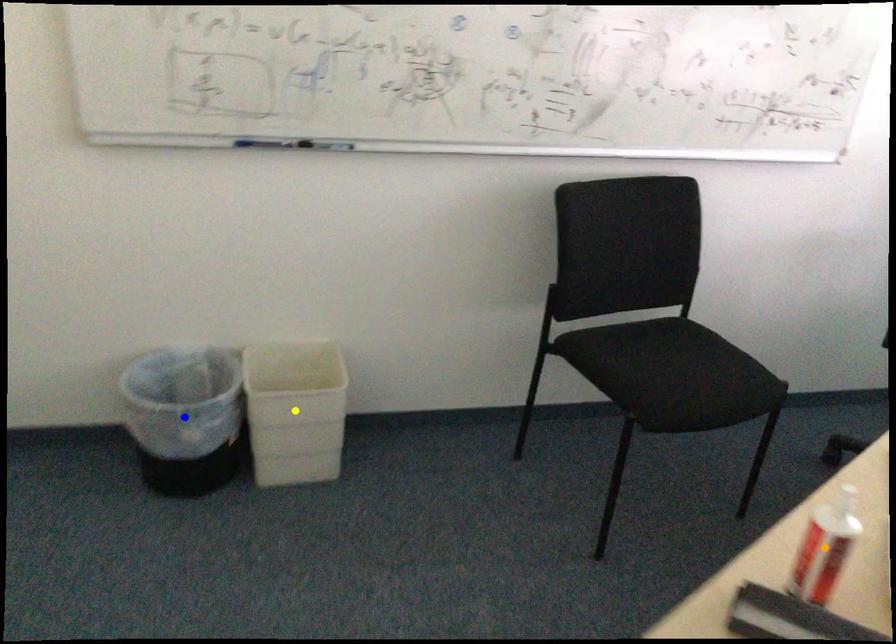
Order these from nearest to farthest:
- yellow point
- blue point
- orange point

orange point, yellow point, blue point